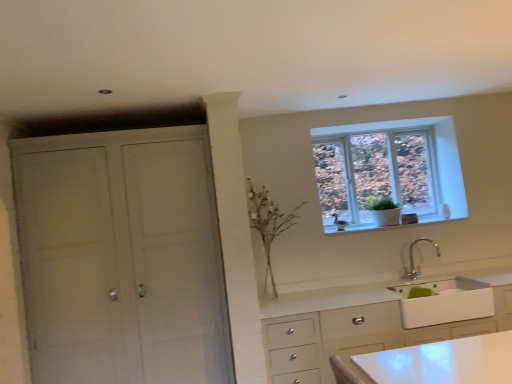
Question: In the image, is white ceramic window sill at upper right positioned in front of or behind silver metallic faucet at lower center?

Choices:
 (A) behind
 (B) front

Answer: (A)

Question: Based on their positions, is white ceramic window sill at upper right located to the left or right of silver metallic faucet at lower center?

Choices:
 (A) left
 (B) right

Answer: (A)

Question: Estimate the real-world distances between objects in this image. Which object is farther from the silver metallic faucet at lower center?

Choices:
 (A) white ceramic window sill at upper right
 (B) white glossy sink at lower right
 (C) clear glass window at upper right
 (D) white matte cabinet at left

Answer: (D)

Question: Estimate the real-world distances between objects in this image. Which object is farther from the clear glass window at upper right?

Choices:
 (A) white matte cabinet at left
 (B) white ceramic window sill at upper right
 (C) white glossy sink at lower right
 (D) silver metallic faucet at lower center

Answer: (A)